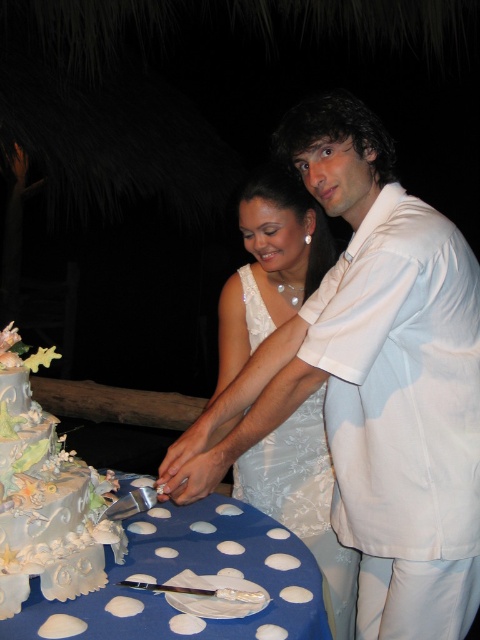
Does white satin dress at center have a smaller size compared to pastel silver cake at lower left?

No, white satin dress at center is not smaller than pastel silver cake at lower left.

Is white satin dress at center below pastel silver cake at lower left?

Yes, white satin dress at center is below pastel silver cake at lower left.

Is point (276, 470) farther from camera compared to point (43, 499)?

Yes, point (276, 470) is behind point (43, 499).

Where is `white satin dress at center`? This screenshot has width=480, height=640. white satin dress at center is located at coordinates (271, 266).

Which of these two, white satin dress at center or blue polka dot tablecloth at lower center, stands taller?

white satin dress at center is taller.

How far apart are white satin dress at center and blue polka dot tablecloth at lower center?

white satin dress at center and blue polka dot tablecloth at lower center are 13.82 inches apart.

Does point (271, 444) lie in front of point (280, 614)?

No, it is behind (280, 614).

Locate an element on the screen. white satin dress at center is located at coordinates (271, 266).

Is white satin dress at center taller than white satin wedding dress at center?

Yes, white satin dress at center is taller than white satin wedding dress at center.

Who is more forward, (243,324) or (319,428)?

Point (319,428) is in front.

Who is more distant from viewer, (218, 376) or (236, 483)?

Point (236, 483)

The image size is (480, 640). What are the coordinates of `white satin dress at center` in the screenshot? It's located at (271, 266).